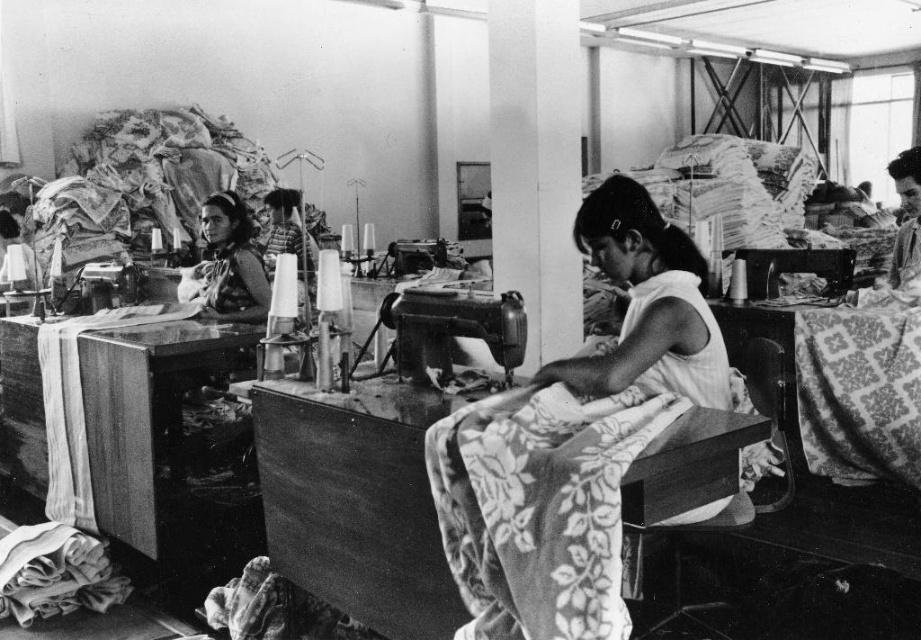
You are standing in the sewing workshop and want to reach both the point at coordinates (836, 403) and the point at coordinates (10, 602). Which point is closer to you?

Point (10, 602) is closer to you because it is less further to the camera than point (836, 403).

You are a tailor working in this sewing workshop. You need to place a new roll of fabric that is 1.2 meters tall. Can the white fabric at center and the metallic sewing machine at center accommodate this new roll in terms of height?

The white fabric at center is taller than the metallic sewing machine at center. Since the new roll is 1.2 meters tall, it can be placed where the white fabric at center is located as it has sufficient height. However, the metallic sewing machine at center may not have enough space due to its shorter height.

You are a tailor in the sewing workshop and need to choose between the patterned fabric at center and the soft cotton fabric at lower left. Which fabric has a bigger size available?

The patterned fabric at center has a larger size compared to the soft cotton fabric at lower left, so the patterned fabric at center is the bigger one available.